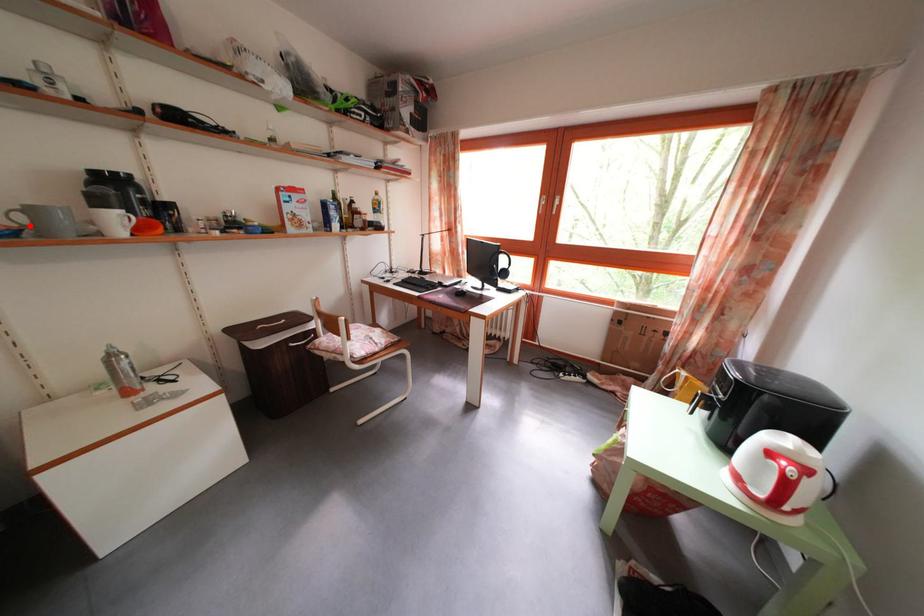
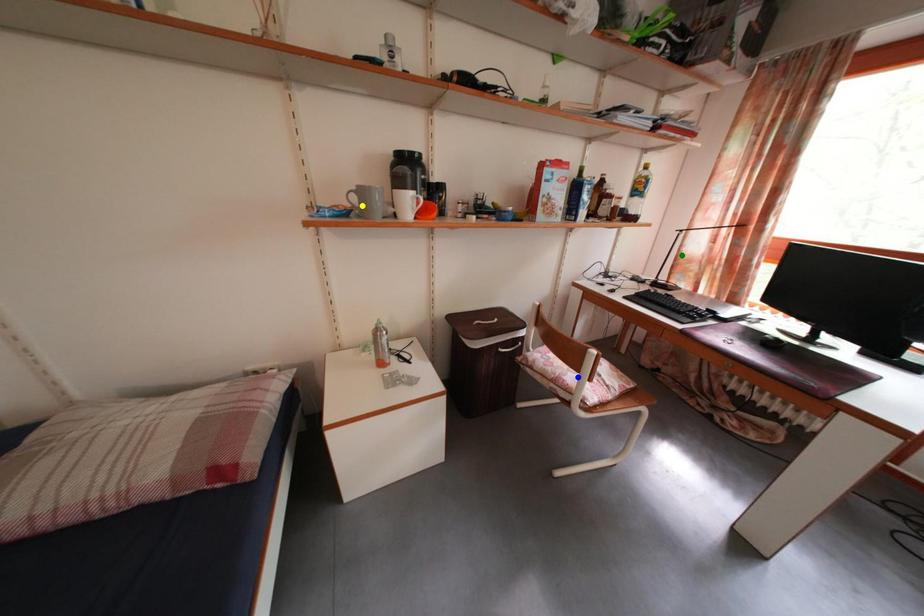
Question: I am providing you with two images of the same scene from different viewpoints. A red point is marked on the first image. You are given multiple points on the second image. Which point in image 2 is actually the same real-world point as the red point in image 1?

Choices:
 (A) yellow point
 (B) blue point
 (C) green point

Answer: (A)